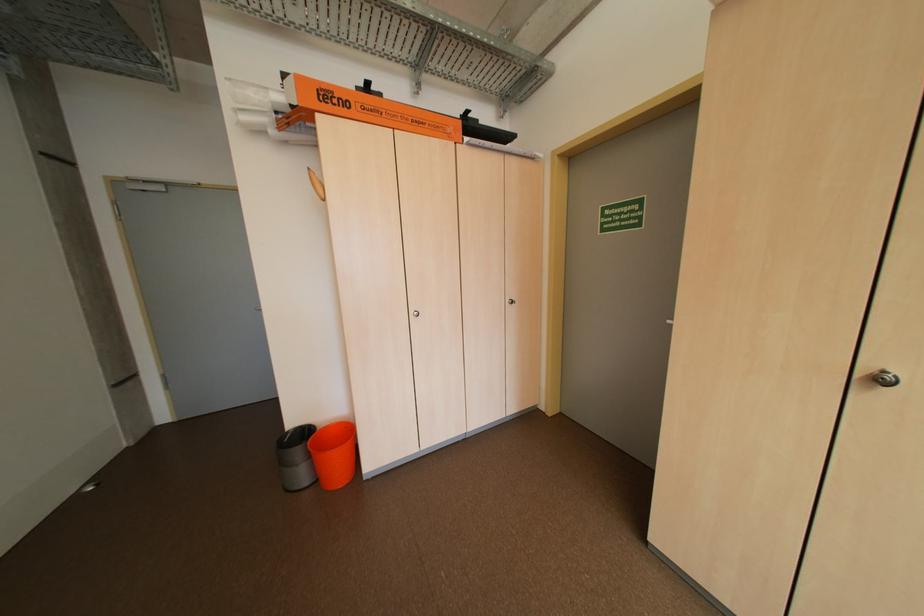
Find where to pull the silver door handle. Please return your answer as a coordinate pair (x, y).

(884, 378)